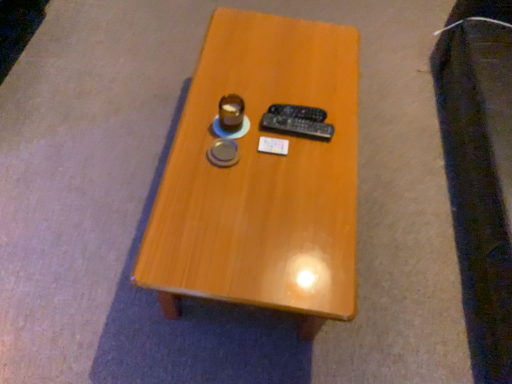
In order to click on vacant space positioned to the left of black plastic remote control at center, arranged as the first remote control when viewed from the front in this screenshot , I will do `click(243, 109)`.